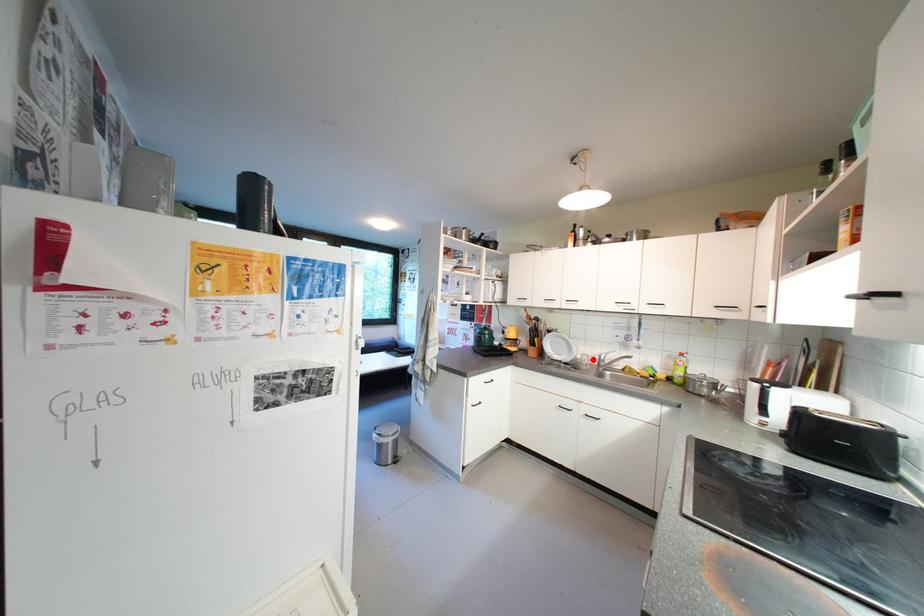
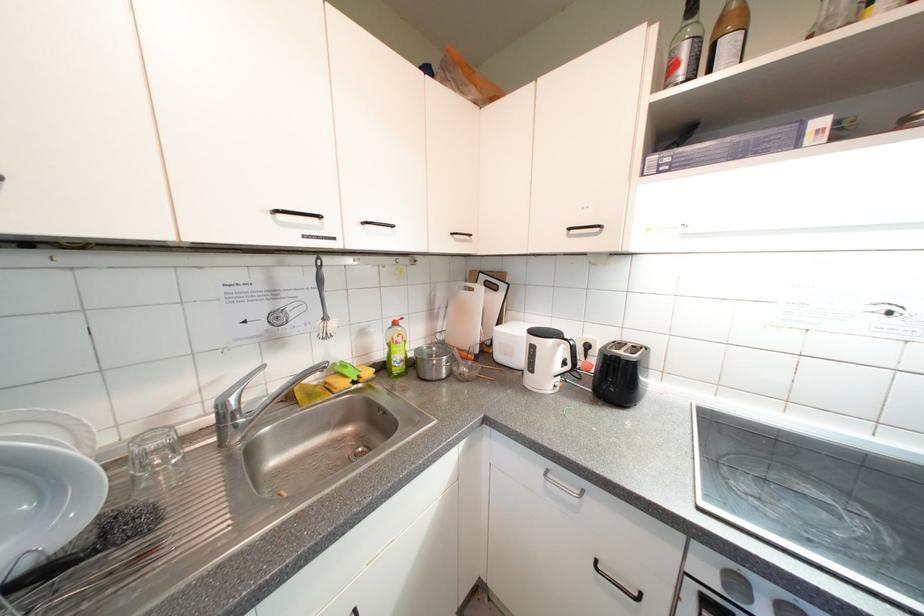
The point at the highlighted location is marked in the first image. Where is the corresponding point in the second image?

(162, 447)